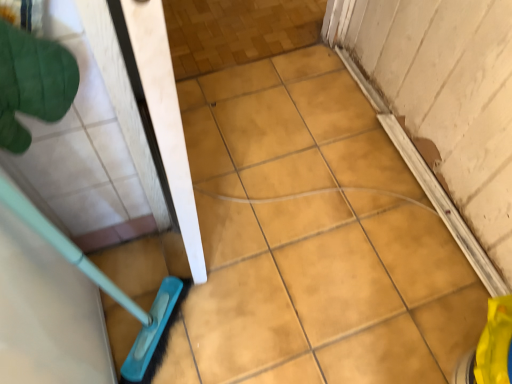
I want to click on free location above yellow matte tile at center, placed as the second ceramic tile when sorted from right to left (from a real-world perspective), so click(290, 233).